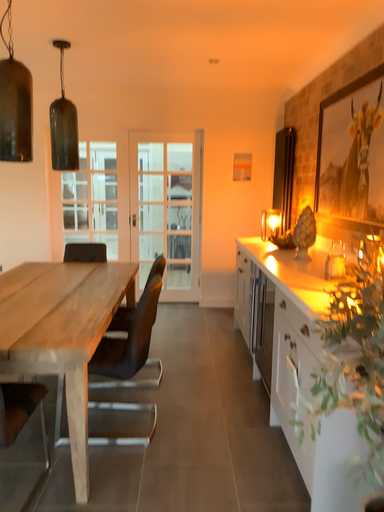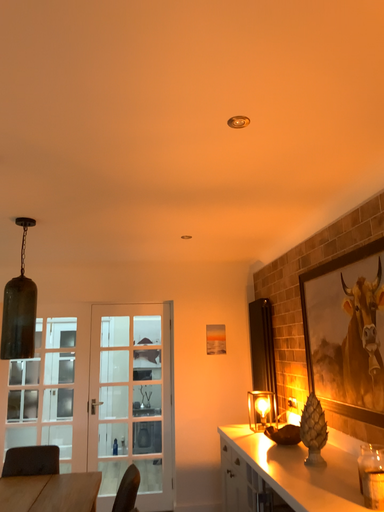
Question: How did the camera likely rotate when shooting the video?

Choices:
 (A) rotated downward
 (B) rotated upward

Answer: (B)